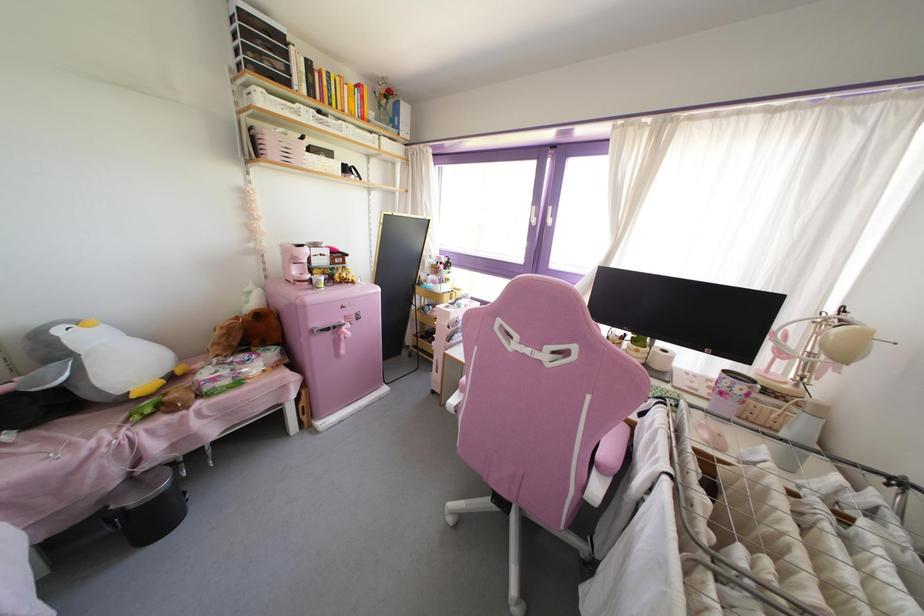
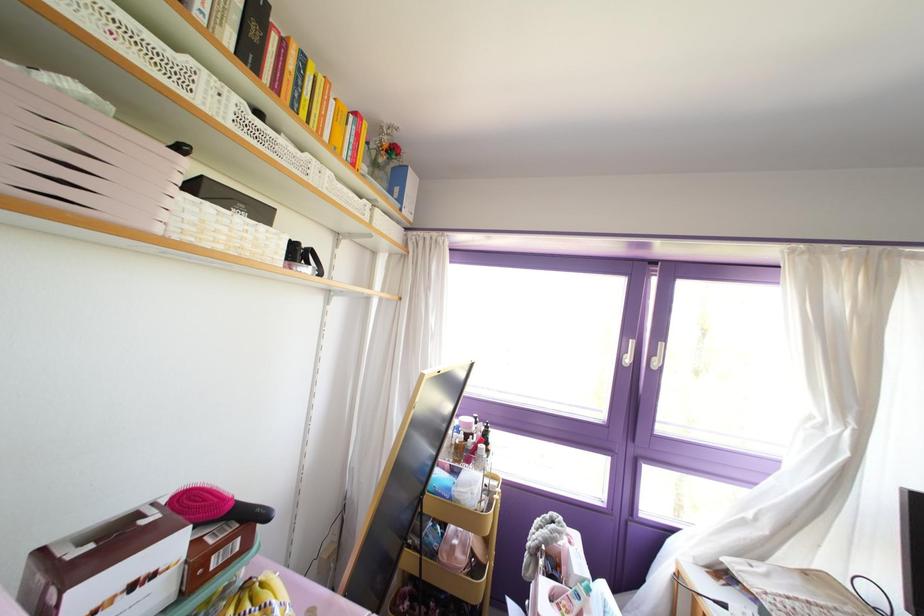
In the second image, find the point that corresponds to point 322,158 in the first image.

(237, 219)